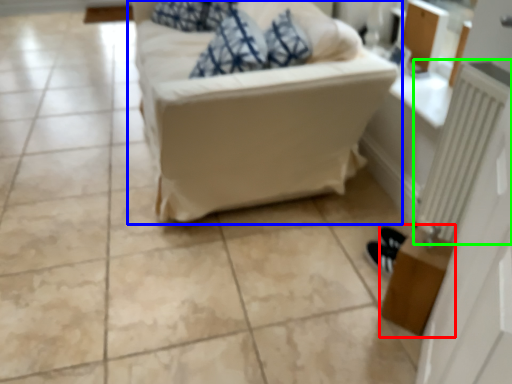
Question: Which object is the closest to the table (highlighted by a red box)? Choose among these: studio couch (highlighted by a blue box) or radiator (highlighted by a green box).

Choices:
 (A) studio couch
 (B) radiator

Answer: (B)